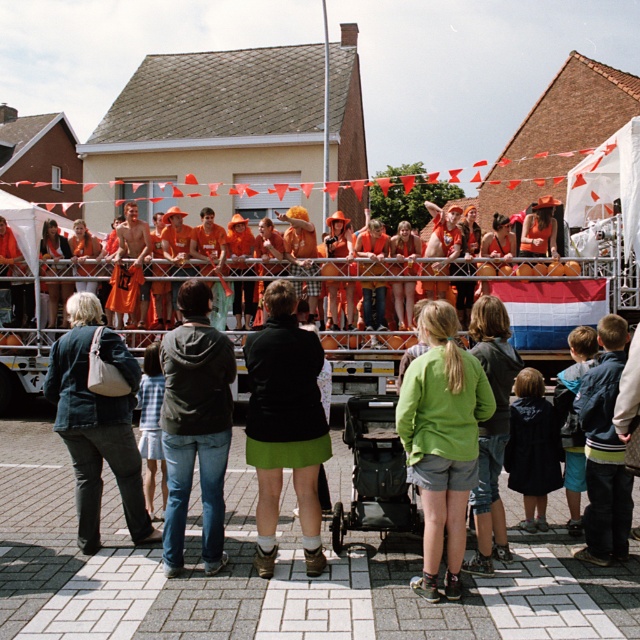
Can you confirm if green skirt at center is shorter than dark gray hoodie at center?

Incorrect, green skirt at center's height does not fall short of dark gray hoodie at center's.

Who is taller, green skirt at center or dark gray hoodie at center?

green skirt at center

The width and height of the screenshot is (640, 640). Identify the location of green skirt at center. (284, 424).

Based on the photo, which of these two, dark gray hoodie at center or green fabric jacket at center, stands shorter?

green fabric jacket at center is shorter.

Is point (186, 400) positioned after point (490, 321)?

No, (186, 400) is closer to viewer.

At what (x,y) coordinates should I click in order to perform the action: click on dark gray hoodie at center. Please return your answer as a coordinate pair (x, y). The height and width of the screenshot is (640, 640). Looking at the image, I should click on click(195, 424).

At what (x,y) coordinates should I click in order to perform the action: click on dark gray hoodie at center. Please return your answer as a coordinate pair (x, y). Image resolution: width=640 pixels, height=640 pixels. Looking at the image, I should click on (195, 424).

Find the location of a particular element. The width and height of the screenshot is (640, 640). dark gray hoodie at center is located at coordinates (195, 424).

Can you confirm if dark gray hoodie at center is thinner than denim jacket at center?

Indeed, dark gray hoodie at center has a lesser width compared to denim jacket at center.

Measure the distance between point [184,401] and camera.

Point [184,401] is 6.34 meters away from camera.

What are the coordinates of `dark gray hoodie at center` in the screenshot? It's located at (195, 424).